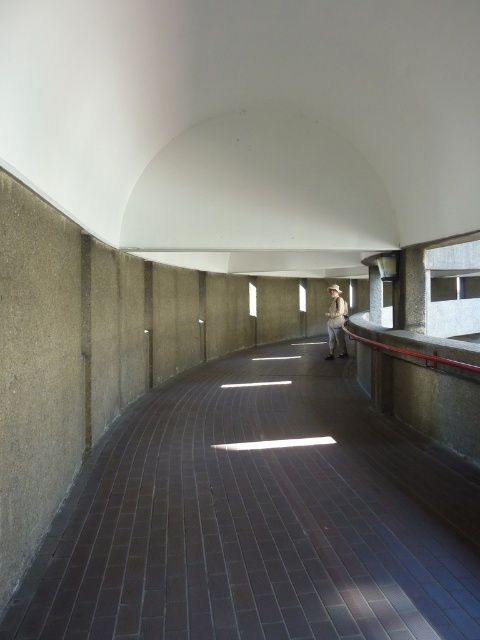
You are standing on the curved pedestrian walkway and notice a khaki fabric shirt at center and a dark brick path at center. Which object is positioned to the left of the other?

The dark brick path at center is to the left of the khaki fabric shirt at center.

You are standing at the entrance of the walkway and want to reach the point closer to the camera. Which point should you head towards, point [345,518] or point [342,340]?

You should head towards point [345,518] because it is closer to the camera than point [342,340].